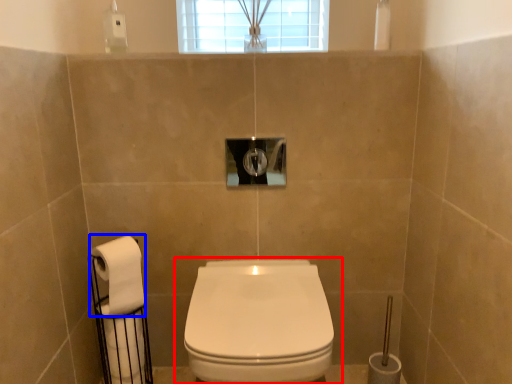
Question: Which point is further to the camera, toilet (highlighted by a red box) or toilet paper (highlighted by a blue box)?

Choices:
 (A) toilet
 (B) toilet paper

Answer: (B)